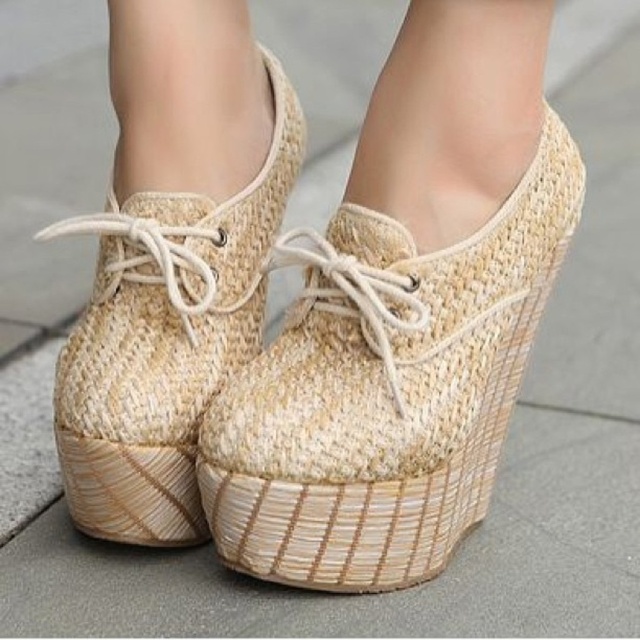
Which is above, natural woven shoe at center or woven beige shoe at center?

woven beige shoe at center is above.

Is natural woven shoe at center below woven beige shoe at center?

Indeed, natural woven shoe at center is positioned under woven beige shoe at center.

Describe the element at coordinates (385, 390) in the screenshot. I see `natural woven shoe at center` at that location.

This screenshot has width=640, height=640. In order to click on natural woven shoe at center in this screenshot , I will do `click(385, 390)`.